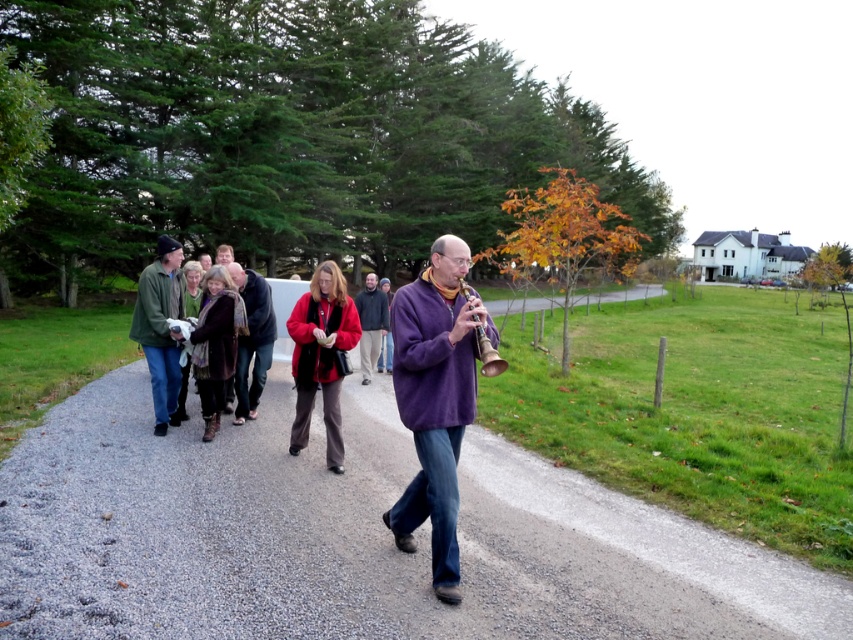
Question: Estimate the real-world distances between objects in this image. Which object is closer to the brown woolen scarf at center?

Choices:
 (A) green wool sweater at left
 (B) red wool sweater at center
 (C) brown wool scarf at center

Answer: (C)

Question: Is purple soft sweater at center below red wool sweater at center?

Choices:
 (A) no
 (B) yes

Answer: (B)

Question: Which object is the farthest from the metallic gold flute at center?

Choices:
 (A) red wool sweater at center
 (B) brown wool scarf at center
 (C) gray gravel path at center

Answer: (A)

Question: Can you confirm if gray gravel path at center is positioned above green wool sweater at left?

Choices:
 (A) no
 (B) yes

Answer: (A)

Question: Which of the following is the closest to the observer?

Choices:
 (A) red wool sweater at center
 (B) purple soft sweater at center
 (C) red fleece jacket at center
 (D) green wool sweater at left

Answer: (B)

Question: Does gray gravel path at center have a larger size compared to green wool sweater at left?

Choices:
 (A) no
 (B) yes

Answer: (A)